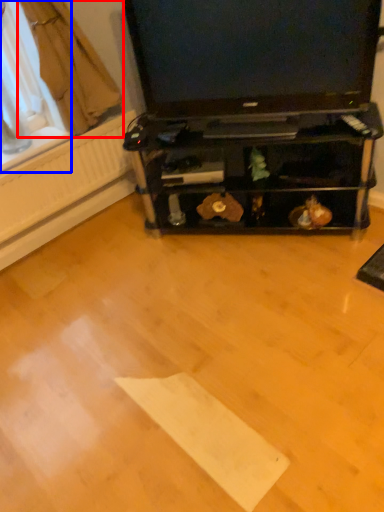
Question: Which point is further to the camera, curtain (highlighted by a red box) or window screen (highlighted by a blue box)?

Choices:
 (A) curtain
 (B) window screen

Answer: (B)